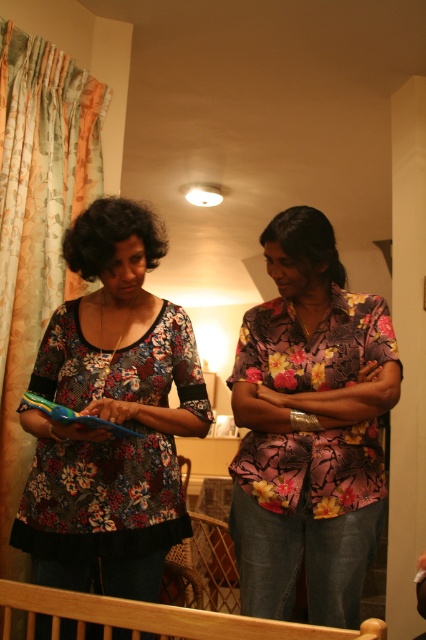
Can you confirm if floral fabric blouse at center is positioned above floral fabric shirt at center?

Yes.

Who is taller, floral fabric blouse at center or floral fabric shirt at center?

floral fabric shirt at center

Where is `floral fabric blouse at center`? floral fabric blouse at center is located at coordinates (111, 416).

At what (x,y) coordinates should I click in order to perform the action: click on floral fabric blouse at center. Please return your answer as a coordinate pair (x, y). The height and width of the screenshot is (640, 426). Looking at the image, I should click on (111, 416).

At what (x,y) coordinates should I click in order to perform the action: click on floral fabric shirt at center. Please return your answer as a coordinate pair (x, y). Image resolution: width=426 pixels, height=640 pixels. Looking at the image, I should click on (310, 428).

Which is above, floral fabric shirt at center or floral fabric curtain at left?

floral fabric curtain at left is higher up.

Which is in front, point (259, 396) or point (39, 333)?

Point (259, 396) is in front.

Locate an element on the screen. This screenshot has height=640, width=426. floral fabric shirt at center is located at coordinates (310, 428).

Is floral fabric blouse at center below floral fabric curtain at left?

Indeed, floral fabric blouse at center is positioned under floral fabric curtain at left.

Identify the location of floral fabric blouse at center. The width and height of the screenshot is (426, 640). (111, 416).

This screenshot has height=640, width=426. What do you see at coordinates (111, 416) in the screenshot?
I see `floral fabric blouse at center` at bounding box center [111, 416].

I want to click on floral fabric blouse at center, so click(x=111, y=416).